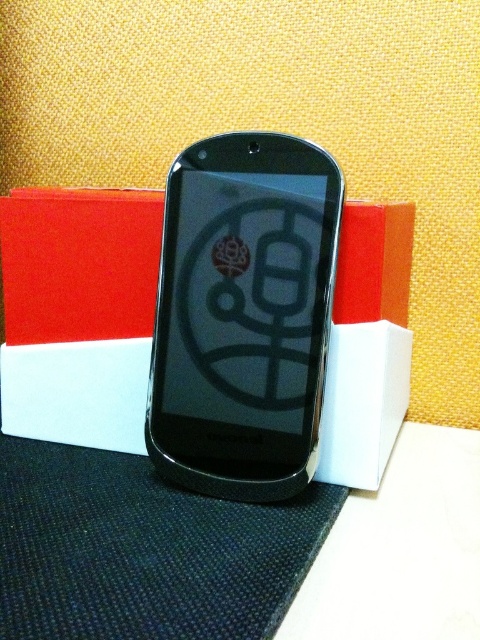
Who is more forward, (x=228, y=326) or (x=103, y=392)?

Point (x=228, y=326)

Can you confirm if black glossy smartphone at center is bigger than white cardboard box at center?

No.

Between point (317, 237) and point (140, 308), which one is positioned in front?

Point (317, 237) is more forward.

You are a GUI agent. You are given a task and a screenshot of the screen. Output one action in this format:
    pyautogui.click(x=<x>, y=<y>)
    Task: Click on the black glossy smartphone at center
    This screenshot has height=640, width=480.
    Given the screenshot: What is the action you would take?
    pyautogui.click(x=243, y=314)